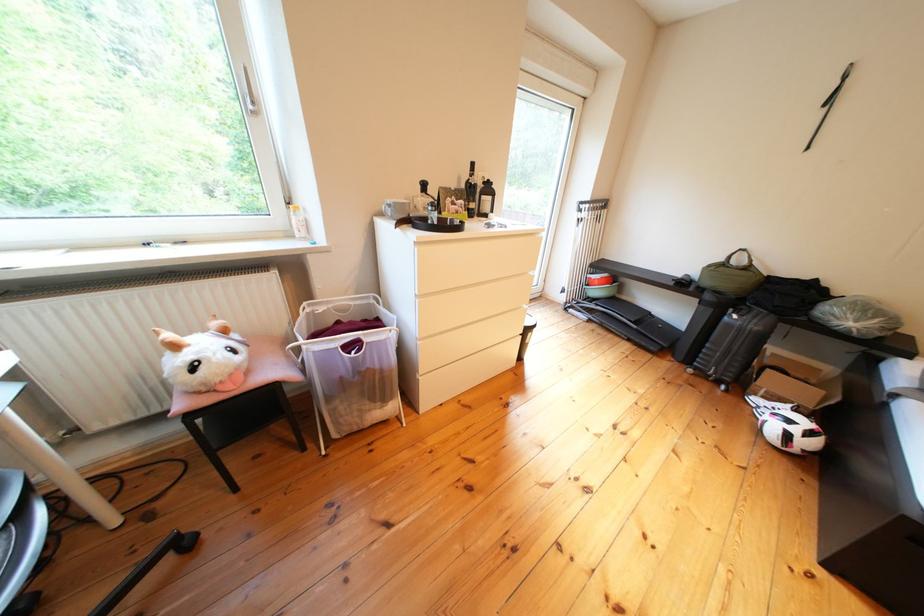
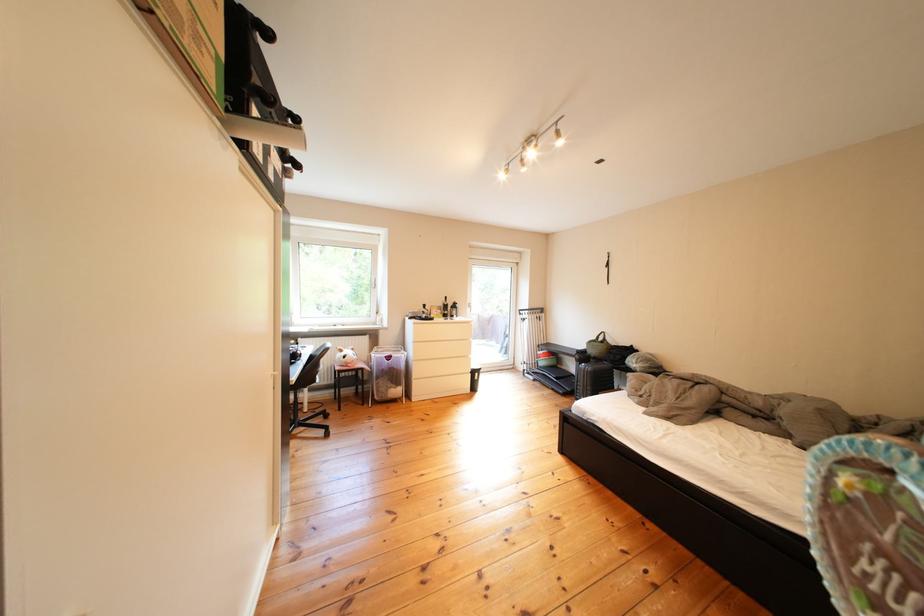
The point at (x=638, y=302) is marked in the first image. Where is the corresponding point in the second image?

(578, 371)